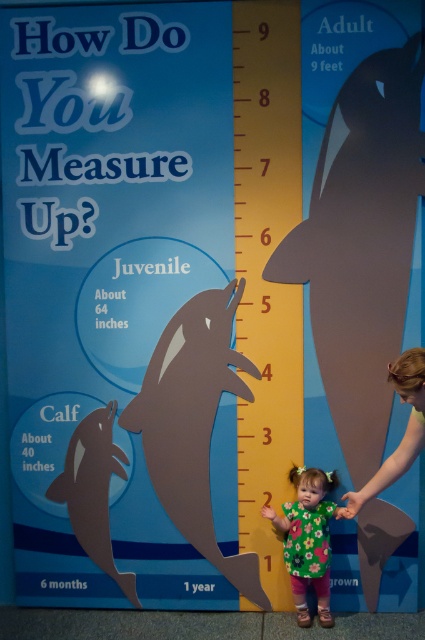
I want to click on matte gray dolphin at center, so click(193, 422).

From the picture: Is the position of matte gray dolphin at center more distant than that of smooth brown hair at lower right?

Yes, it is behind smooth brown hair at lower right.

I want to click on matte gray dolphin at center, so click(193, 422).

Identify the location of matte gray dolphin at center. (193, 422).

In the scene shown: Is gray matte whale at right wider than smooth brown hair at lower right?

Correct, the width of gray matte whale at right exceeds that of smooth brown hair at lower right.

Is point (326, 92) more distant than point (418, 369)?

Yes, point (326, 92) is farther from viewer.

You are a GUI agent. You are given a task and a screenshot of the screen. Output one action in this format:
    pyautogui.click(x=<x>, y=<y>)
    Task: Click on the gray matte whale at right
    
    Given the screenshot: What is the action you would take?
    pyautogui.click(x=360, y=246)

Is point (107, 420) farther from camera compared to point (306, 488)?

Yes, it is behind point (306, 488).

Measure the distance between point (107, 442) and camera.

The distance of point (107, 442) from camera is 11.13 feet.

Which is behind, point (87, 477) or point (325, 502)?

Positioned behind is point (87, 477).

Where is `matte black dolphin at lower left`? This screenshot has height=640, width=425. matte black dolphin at lower left is located at coordinates (93, 490).